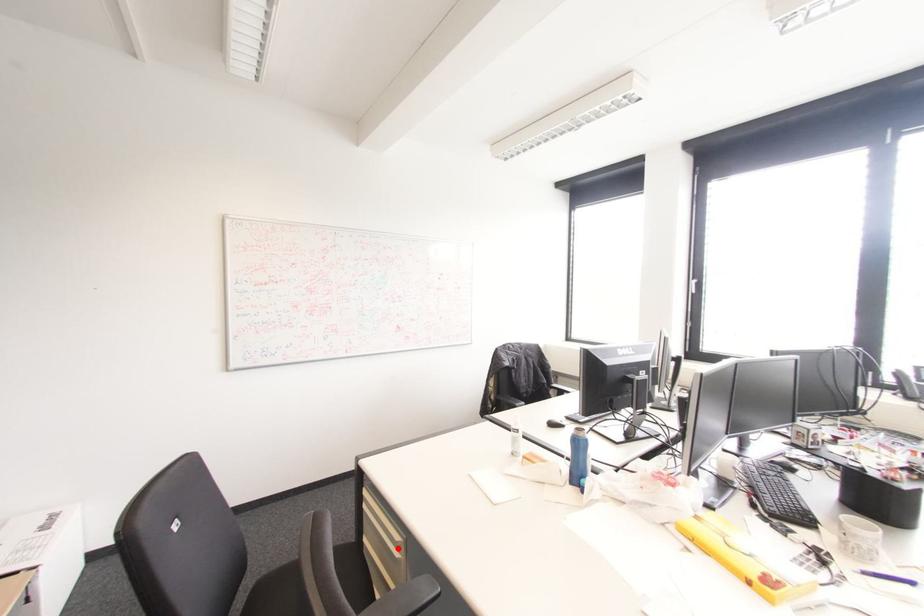
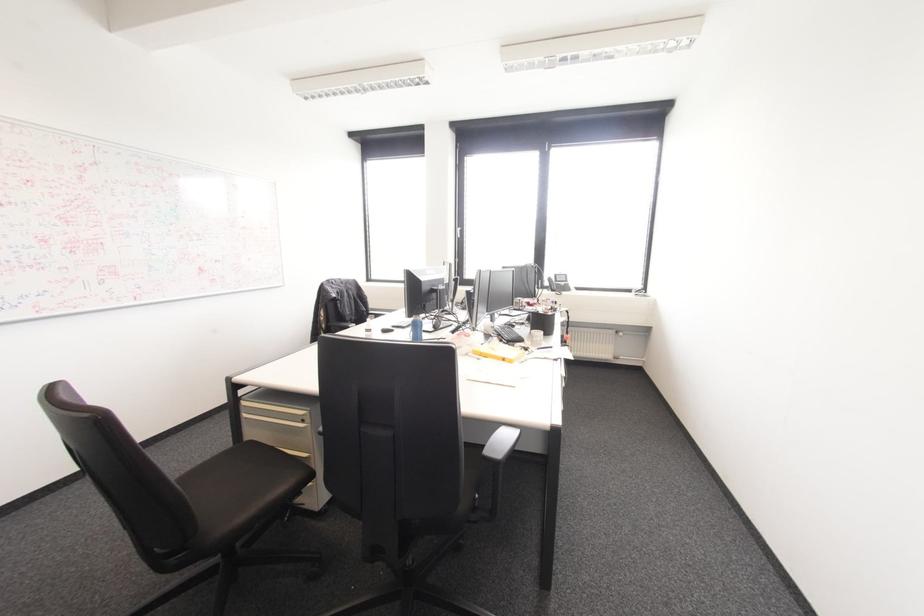
Where in the second image is the point corresponding to the highlighted location from the first image?

(302, 419)